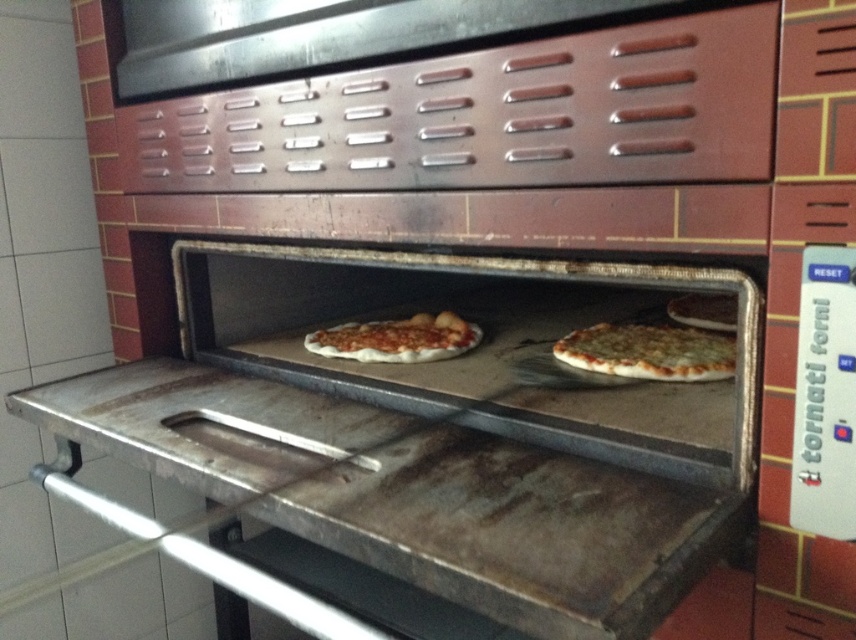
Is golden brown crusty pizza at center thinner than matte white pizza at center?

Correct, golden brown crusty pizza at center's width is less than matte white pizza at center's.

Between golden brown crusty pizza at center and matte white pizza at center, which one appears on the left side from the viewer's perspective?

From the viewer's perspective, matte white pizza at center appears more on the left side.

Where is `golden brown crusty pizza at center`? golden brown crusty pizza at center is located at coordinates (649, 352).